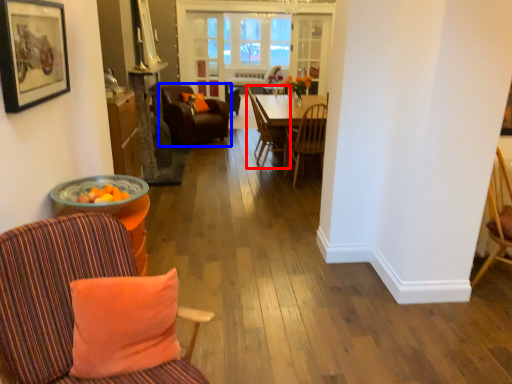
Question: Which point is further to the camera, chair (highlighted by a red box) or chair (highlighted by a blue box)?

Choices:
 (A) chair
 (B) chair

Answer: (B)